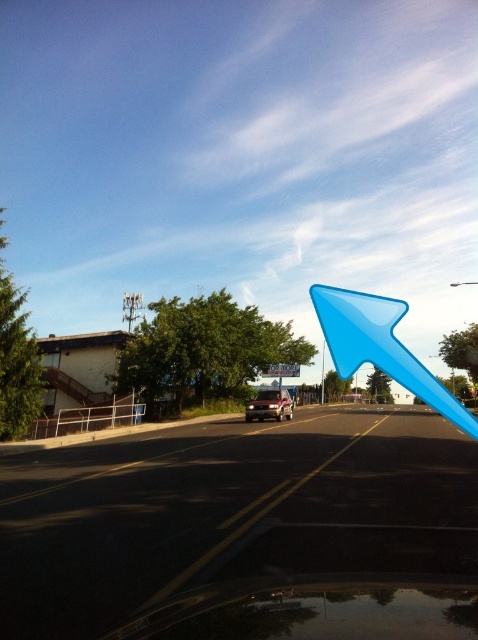
Consider the image. Can you confirm if black asphalt parking lot at center is positioned above blue plastic pole at center?

Yes, black asphalt parking lot at center is above blue plastic pole at center.

Between black asphalt parking lot at center and blue plastic pole at center, which one is positioned lower?

blue plastic pole at center is lower down.

Who is more distant from viewer, [10,524] or [324,346]?

The point [324,346] is behind.

Find the location of a particular element. The width and height of the screenshot is (478, 640). black asphalt parking lot at center is located at coordinates (246, 531).

Is point (263, 376) positioned after point (323, 387)?

No, (263, 376) is in front of (323, 387).

This screenshot has height=640, width=478. I want to click on white plastic street sign at center, so click(x=281, y=371).

Does black asphalt parking lot at center appear under satin silver suv at center?

Incorrect, black asphalt parking lot at center is not positioned below satin silver suv at center.

How distant is black asphalt parking lot at center from satin silver suv at center?

black asphalt parking lot at center is 45.26 feet away from satin silver suv at center.

Where is `black asphalt parking lot at center`? The image size is (478, 640). black asphalt parking lot at center is located at coordinates tap(246, 531).